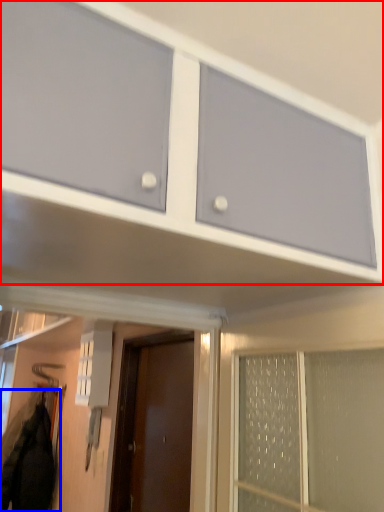
Question: Among these objects, which one is nearest to the camera, cabinetry (highlighted by a red box) or jacket (highlighted by a blue box)?

Choices:
 (A) cabinetry
 (B) jacket

Answer: (A)